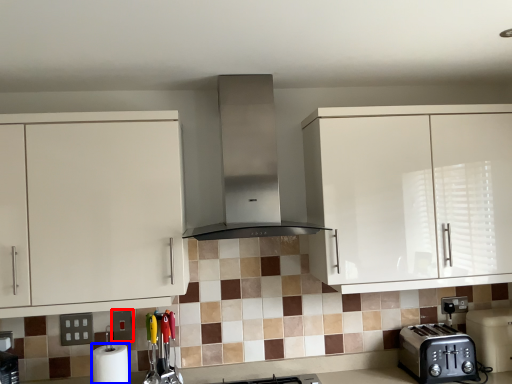
Question: Among these objects, which one is farthest to the camera, square (highlighted by a red box) or paper towel (highlighted by a blue box)?

Choices:
 (A) square
 (B) paper towel

Answer: (A)